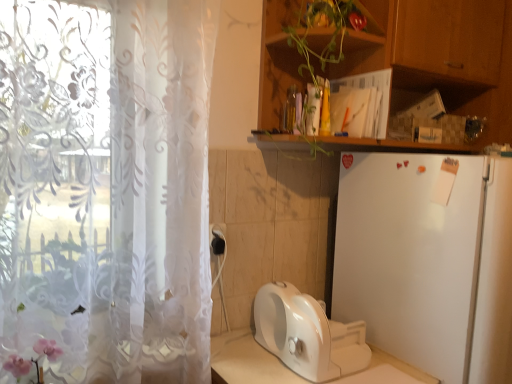
Question: Should I look upward or downward to see white matte refrigerator at right?

Choices:
 (A) up
 (B) down

Answer: (B)

Question: Does transparent floral curtain at left have a lesser width compared to white glossy toaster at lower center?

Choices:
 (A) yes
 (B) no

Answer: (A)

Question: From the image's perspective, is transparent floral curtain at left over white glossy toaster at lower center?

Choices:
 (A) yes
 (B) no

Answer: (A)

Question: Considering the relative sizes of transparent floral curtain at left and white glossy toaster at lower center in the image provided, is transparent floral curtain at left bigger than white glossy toaster at lower center?

Choices:
 (A) yes
 (B) no

Answer: (A)

Question: Does transparent floral curtain at left have a lesser height compared to white glossy toaster at lower center?

Choices:
 (A) yes
 (B) no

Answer: (B)

Question: Is transparent floral curtain at left smaller than white glossy toaster at lower center?

Choices:
 (A) yes
 (B) no

Answer: (B)

Question: From a real-world perspective, is transparent floral curtain at left located higher than white glossy toaster at lower center?

Choices:
 (A) yes
 (B) no

Answer: (A)

Question: Is white glossy toaster at lower center far from white matte refrigerator at right?

Choices:
 (A) yes
 (B) no

Answer: (B)

Question: Can you confirm if white glossy toaster at lower center is bigger than white matte refrigerator at right?

Choices:
 (A) no
 (B) yes

Answer: (A)

Question: From the image's perspective, is white glossy toaster at lower center on top of white matte refrigerator at right?

Choices:
 (A) no
 (B) yes

Answer: (A)

Question: Is white glossy toaster at lower center taller than white matte refrigerator at right?

Choices:
 (A) no
 (B) yes

Answer: (A)

Question: From the image's perspective, is white glossy toaster at lower center beneath white matte refrigerator at right?

Choices:
 (A) yes
 (B) no

Answer: (A)

Question: Is white glossy toaster at lower center smaller than white matte refrigerator at right?

Choices:
 (A) no
 (B) yes

Answer: (B)

Question: Does black plastic electric outlet at lower center appear on the left side of wooden cabinet at upper right?

Choices:
 (A) yes
 (B) no

Answer: (A)